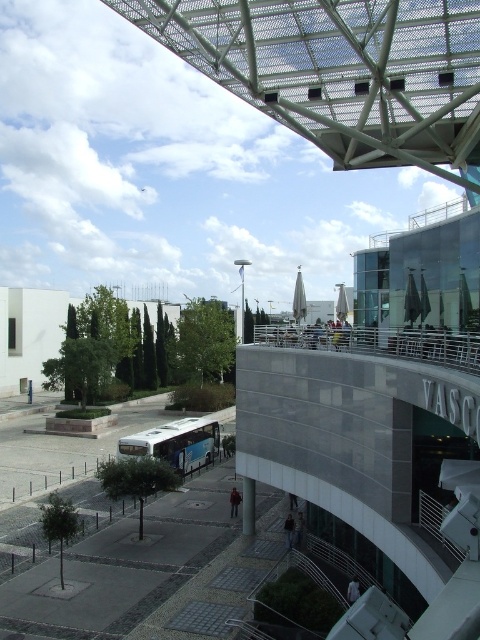
Does point (190, 449) come behind point (251, 515)?

Yes, it is behind point (251, 515).

You are a GUI agent. You are given a task and a screenshot of the screen. Output one action in this format:
    pyautogui.click(x=<x>, y=<y>)
    Task: Click on the blue metallic bus at center
    
    Given the screenshot: What is the action you would take?
    pyautogui.click(x=175, y=444)